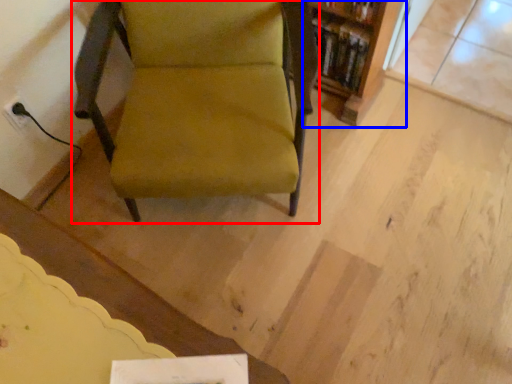
Question: Which object appears farthest to the camera in this image, chair (highlighted by a red box) or shelf (highlighted by a blue box)?

Choices:
 (A) chair
 (B) shelf

Answer: (B)